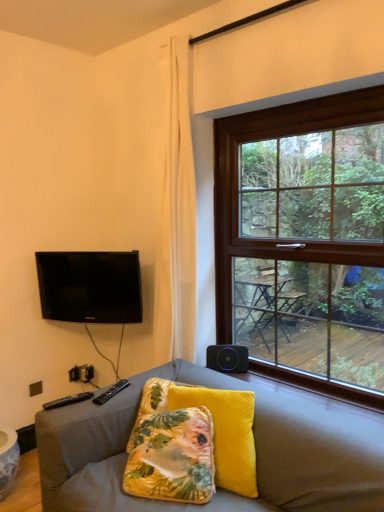
Measure the distance between point (122, 382) and camera.

They are 6.71 feet apart.

What do you see at coordinates (111, 392) in the screenshot? I see `black plastic remote at lower left` at bounding box center [111, 392].

Describe the element at coordinates (305, 241) in the screenshot. I see `brown wooden window at upper right` at that location.

At what (x,y) coordinates should I click in order to perform the action: click on velvet yellow pillow at center. Please return your answer as a coordinate pair (x, y). Looking at the image, I should click on (226, 433).

Measure the distance between black matte speaker at lower right and camera.

black matte speaker at lower right is 2.35 meters away from camera.

The width and height of the screenshot is (384, 512). I want to click on velvet floral pillow at center, so coord(172,457).

Can you confirm if velvet yellow pillow at center is positioned to the left of velvet floral pillow at center?

Incorrect, velvet yellow pillow at center is not on the left side of velvet floral pillow at center.

Considering the sizes of objects velvet yellow pillow at center and velvet floral pillow at center in the image provided, who is taller, velvet yellow pillow at center or velvet floral pillow at center?

With more height is velvet yellow pillow at center.

Is velvet yellow pillow at center located outside velvet floral pillow at center?

Yes, velvet yellow pillow at center is located beyond the bounds of velvet floral pillow at center.

From a real-world perspective, between velvet yellow pillow at center and velvet floral pillow at center, who is vertically higher?

velvet yellow pillow at center, from a real-world perspective.

Is velvet floral pillow at center next to velvet yellow pillow at center and touching it?

No.

This screenshot has width=384, height=512. I want to click on throw pillow in front of the velvet yellow pillow at center, so click(x=172, y=457).

Which is more to the left, velvet floral pillow at center or velvet yellow pillow at center?

velvet floral pillow at center is more to the left.

Is velvet floral pillow at center turned away from velvet yellow pillow at center?

That's right, velvet floral pillow at center is facing away from velvet yellow pillow at center.

Is black glossy tv at upper left aimed at black matte speaker at lower right?

No, black glossy tv at upper left does not turn towards black matte speaker at lower right.

From the picture: Is the position of black glossy tv at upper left more distant than that of black matte speaker at lower right?

No, it is in front of black matte speaker at lower right.

From a real-world perspective, who is located higher, black glossy tv at upper left or black matte speaker at lower right?

black glossy tv at upper left, from a real-world perspective.

Is point (89, 294) in front of point (208, 357)?

No, it is not.

Is velvet floral pillow at center situated inside black matte speaker at lower right or outside?

velvet floral pillow at center cannot be found inside black matte speaker at lower right.

From a real-world perspective, which is physically below, velvet floral pillow at center or black matte speaker at lower right?

In real-world perspective, velvet floral pillow at center is lower.

Is velvet floral pillow at center oriented away from black matte speaker at lower right?

Absolutely, velvet floral pillow at center is directed away from black matte speaker at lower right.

Does velvet floral pillow at center have a lesser height compared to black matte speaker at lower right?

In fact, velvet floral pillow at center may be taller than black matte speaker at lower right.

Do you think velvet gray couch at lower center is within velvet yellow pillow at center, or outside of it?

velvet gray couch at lower center exists outside the volume of velvet yellow pillow at center.

In the image, is velvet gray couch at lower center positioned in front of or behind velvet yellow pillow at center?

In the image, velvet gray couch at lower center appears in front of velvet yellow pillow at center.

From the image's perspective, which is above, velvet gray couch at lower center or velvet yellow pillow at center?

velvet yellow pillow at center appears higher in the image.

Is there a large distance between velvet gray couch at lower center and velvet yellow pillow at center?

No, velvet gray couch at lower center is in close proximity to velvet yellow pillow at center.

In the scene shown: Does black plastic remote at lower left lie behind black glossy tv at upper left?

No, it is not.

From a real-world perspective, relative to black glossy tv at upper left, is black plastic remote at lower left vertically above or below?

black plastic remote at lower left is below black glossy tv at upper left.

Is black plastic remote at lower left to the left of black glossy tv at upper left from the viewer's perspective?

Incorrect, black plastic remote at lower left is not on the left side of black glossy tv at upper left.

From the image's perspective, between black matte speaker at lower right and black glossy tv at upper left, who is located below?

black matte speaker at lower right, from the image's perspective.

Which is correct: black matte speaker at lower right is inside black glossy tv at upper left, or outside of it?

black matte speaker at lower right cannot be found inside black glossy tv at upper left.

Which is more to the left, black matte speaker at lower right or black glossy tv at upper left?

black glossy tv at upper left.

Considering the positions of objects black matte speaker at lower right and black glossy tv at upper left in the image provided, who is behind, black matte speaker at lower right or black glossy tv at upper left?

black matte speaker at lower right is further from the camera.

What are the coordinates of `throw pillow in front of the velvet yellow pillow at center` in the screenshot? It's located at (172, 457).

I want to click on throw pillow below the velvet yellow pillow at center (from the image's perspective), so click(172, 457).

From the picture: From the image, which object appears to be nearer to black matte speaker at lower right, black plastic remote at lower left or velvet yellow pillow at center?

The object closer to black matte speaker at lower right is velvet yellow pillow at center.

From the image, which object appears to be farther from black glossy tv at upper left, black matte speaker at lower right or black plastic remote at lower left?

black matte speaker at lower right is positioned further to the anchor black glossy tv at upper left.

Estimate the real-world distances between objects in this image. Which object is further from black glossy tv at upper left, black matte speaker at lower right or velvet floral pillow at center?

Among the two, velvet floral pillow at center is located further to black glossy tv at upper left.

Considering their positions, is black plastic remote at lower left positioned closer to velvet floral pillow at center than brown wooden window at upper right?

Among the two, black plastic remote at lower left is located nearer to velvet floral pillow at center.

When comparing their distances from velvet yellow pillow at center, does brown wooden window at upper right or velvet floral pillow at center seem closer?

The object closer to velvet yellow pillow at center is velvet floral pillow at center.

From the image, which object appears to be nearer to black plastic remote at lower left, black matte speaker at lower right or velvet yellow pillow at center?

Based on the image, velvet yellow pillow at center appears to be nearer to black plastic remote at lower left.

Based on their spatial positions, is velvet yellow pillow at center or black plastic remote at lower left further from black matte speaker at lower right?

black plastic remote at lower left is positioned further to the anchor black matte speaker at lower right.

Which object lies further to the anchor point black plastic remote at lower left, velvet gray couch at lower center or brown wooden window at upper right?

Based on the image, brown wooden window at upper right appears to be further to black plastic remote at lower left.

Find the location of `window between velvet floral pillow at center and black matte speaker at lower right from front to back`. window between velvet floral pillow at center and black matte speaker at lower right from front to back is located at coordinates (305, 241).

Find the location of `loudspeaker between black plastic remote at lower left and brown wooden window at upper right in the horizontal direction`. loudspeaker between black plastic remote at lower left and brown wooden window at upper right in the horizontal direction is located at coordinates (227, 358).

You are a GUI agent. You are given a task and a screenshot of the screen. Output one action in this format:
    pyautogui.click(x=<x>, y=<y>)
    Task: Click on the throw pillow located between velvet gray couch at lower center and velvet yellow pillow at center in the depth direction
    This screenshot has height=512, width=384.
    Given the screenshot: What is the action you would take?
    pyautogui.click(x=172, y=457)

Where is `remote between velvet floral pillow at center and black glossy tv at upper left in the front-back direction`? remote between velvet floral pillow at center and black glossy tv at upper left in the front-back direction is located at coordinates (111, 392).